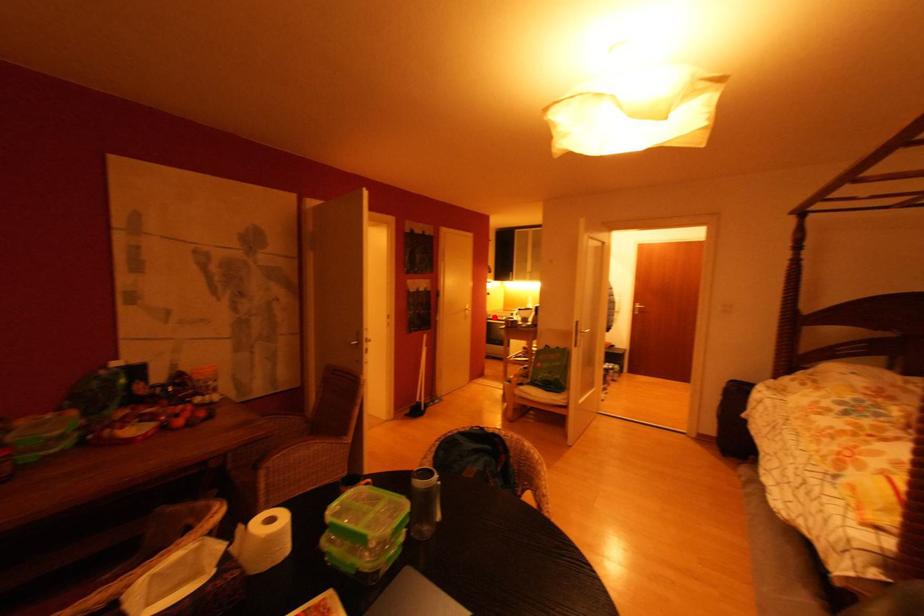
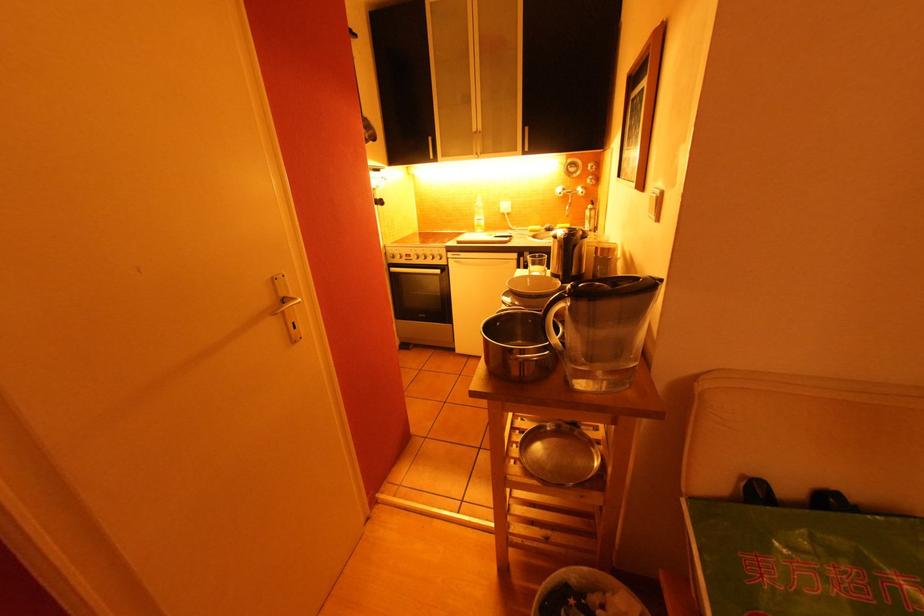
Locate, in the second image, the point that corresponds to the highlighted location in the first image.

(398, 259)